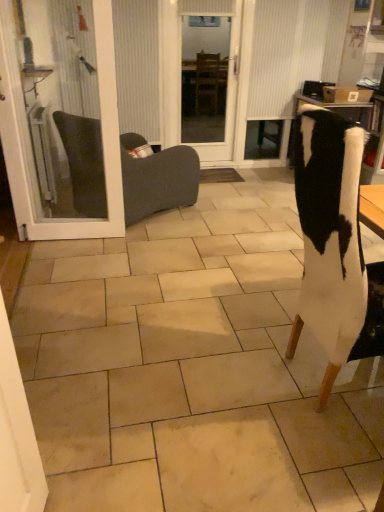
Image resolution: width=384 pixels, height=512 pixels. In order to click on free space behind white fur chair at right, placed as the first chair when sorted from right to left in this screenshot , I will do `click(266, 308)`.